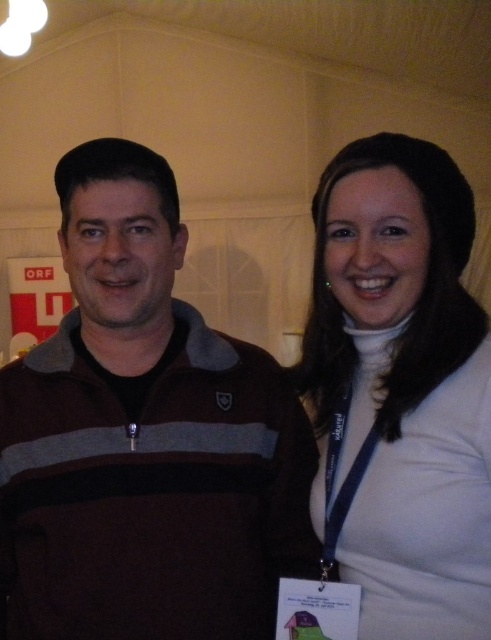
You are organizing a photo shoot and need to ensure that all clothing items in the image are visible. Given the scene described, which clothing item, the brown fleece at left or the white matte turtleneck at upper right, should you focus on adjusting to ensure it is fully visible in the frame?

The brown fleece at left is taller than the white matte turtleneck at upper right, so you should focus on adjusting the brown fleece at left to ensure it is fully visible in the frame since it is taller and might be more likely to be cut off if not properly positioned.

You are at a conference and need to find the person wearing the brown fleece at left. Which direction should you look relative to the white matte turtleneck at upper right?

The brown fleece at left is to the left of the white matte turtleneck at upper right, so you should look to the left side relative to the white matte turtleneck at upper right.